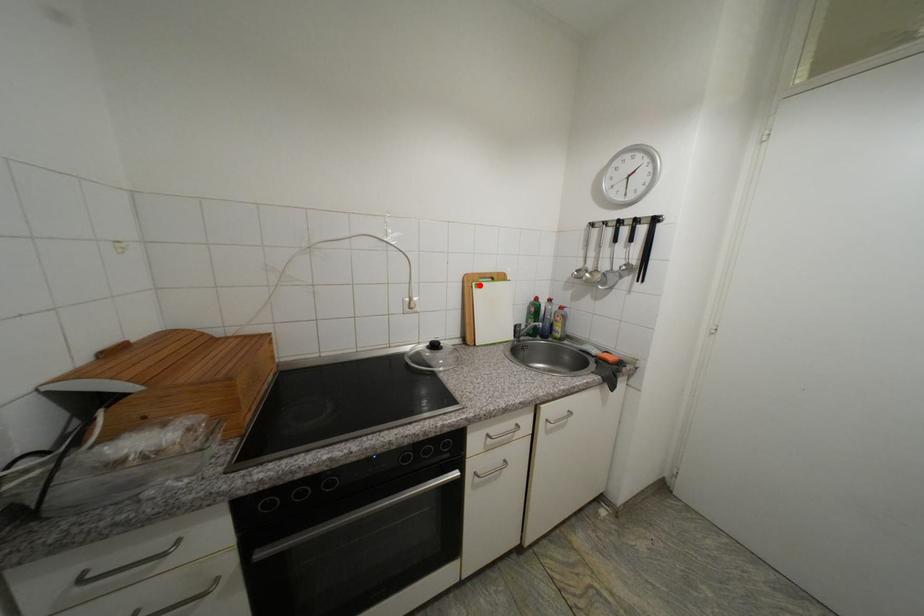
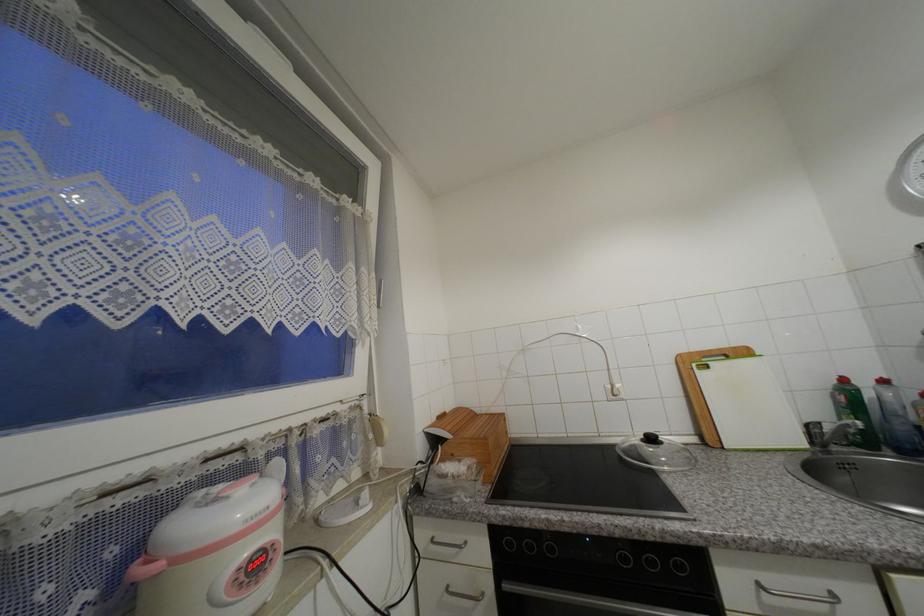
In the second image, find the point that corresponds to the highlighted location in the first image.

(699, 367)